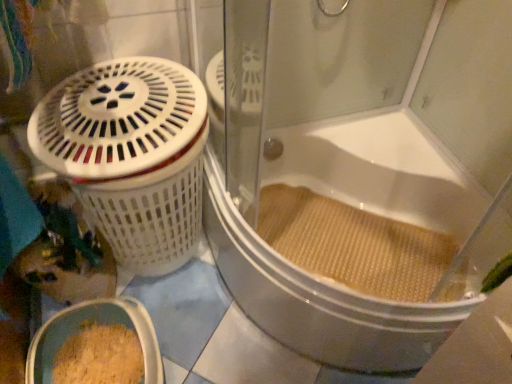
Question: Is beige textured mat at lower right located outside white textured bathtub at center?

Choices:
 (A) yes
 (B) no

Answer: (B)

Question: Considering the relative sizes of beige textured mat at lower right and white textured bathtub at center in the image provided, is beige textured mat at lower right bigger than white textured bathtub at center?

Choices:
 (A) yes
 (B) no

Answer: (B)

Question: Is beige textured mat at lower right at the right side of white textured bathtub at center?

Choices:
 (A) yes
 (B) no

Answer: (B)

Question: Does beige textured mat at lower right lie in front of white textured bathtub at center?

Choices:
 (A) no
 (B) yes

Answer: (A)

Question: Does beige textured mat at lower right have a greater width compared to white textured bathtub at center?

Choices:
 (A) no
 (B) yes

Answer: (A)

Question: Is beige textured mat at lower right aimed at white textured bathtub at center?

Choices:
 (A) no
 (B) yes

Answer: (B)

Question: Is beige textured mat at lower right thinner than white plastic basket at left?

Choices:
 (A) yes
 (B) no

Answer: (A)

Question: From a real-world perspective, is beige textured mat at lower right positioned under white plastic basket at left based on gravity?

Choices:
 (A) no
 (B) yes

Answer: (B)

Question: Is beige textured mat at lower right with white plastic basket at left?

Choices:
 (A) yes
 (B) no

Answer: (B)

Question: Is beige textured mat at lower right facing towards white plastic basket at left?

Choices:
 (A) no
 (B) yes

Answer: (A)

Question: Is white plastic basket at left completely or partially inside beige textured mat at lower right?

Choices:
 (A) no
 (B) yes

Answer: (A)

Question: Is beige textured mat at lower right oriented away from white plastic basket at left?

Choices:
 (A) yes
 (B) no

Answer: (B)

Question: Is white textured bathtub at center oriented away from white plastic basket at left?

Choices:
 (A) yes
 (B) no

Answer: (B)